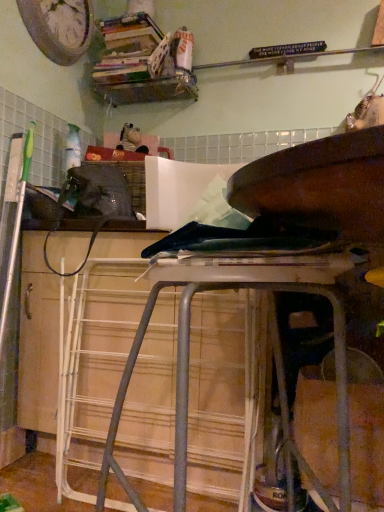
Question: Can you confirm if metallic silver stool at center is thinner than wooden bookshelf at upper center?

Choices:
 (A) no
 (B) yes

Answer: (A)

Question: Considering the relative positions of metallic silver stool at center and wooden bookshelf at upper center in the image provided, is metallic silver stool at center to the right of wooden bookshelf at upper center from the viewer's perspective?

Choices:
 (A) yes
 (B) no

Answer: (A)

Question: Does metallic silver stool at center have a lesser height compared to wooden bookshelf at upper center?

Choices:
 (A) yes
 (B) no

Answer: (B)

Question: Is wooden bookshelf at upper center at the back of metallic silver stool at center?

Choices:
 (A) yes
 (B) no

Answer: (B)

Question: From a real-world perspective, is metallic silver stool at center physically below wooden bookshelf at upper center?

Choices:
 (A) no
 (B) yes

Answer: (B)

Question: Is metallic silver stool at center bigger or smaller than wooden clock at upper left?

Choices:
 (A) small
 (B) big

Answer: (B)

Question: Considering the positions of metallic silver stool at center and wooden clock at upper left in the image, is metallic silver stool at center taller or shorter than wooden clock at upper left?

Choices:
 (A) tall
 (B) short

Answer: (A)

Question: Does point (107, 446) appear closer or farther from the camera than point (66, 60)?

Choices:
 (A) closer
 (B) farther

Answer: (A)

Question: Is metallic silver stool at center wider or thinner than wooden clock at upper left?

Choices:
 (A) thin
 (B) wide

Answer: (B)

Question: From a real-world perspective, is wooden bookshelf at upper center positioned above or below wooden clock at upper left?

Choices:
 (A) below
 (B) above

Answer: (A)

Question: In terms of height, does wooden bookshelf at upper center look taller or shorter compared to wooden clock at upper left?

Choices:
 (A) short
 (B) tall

Answer: (A)

Question: Is wooden bookshelf at upper center inside or outside of wooden clock at upper left?

Choices:
 (A) outside
 (B) inside

Answer: (A)

Question: From the image's perspective, is wooden bookshelf at upper center above or below wooden clock at upper left?

Choices:
 (A) above
 (B) below

Answer: (B)

Question: In terms of size, does wooden clock at upper left appear bigger or smaller than wooden bookshelf at upper center?

Choices:
 (A) small
 (B) big

Answer: (A)

Question: From the image's perspective, relative to wooden bookshelf at upper center, is wooden clock at upper left above or below?

Choices:
 (A) below
 (B) above

Answer: (B)